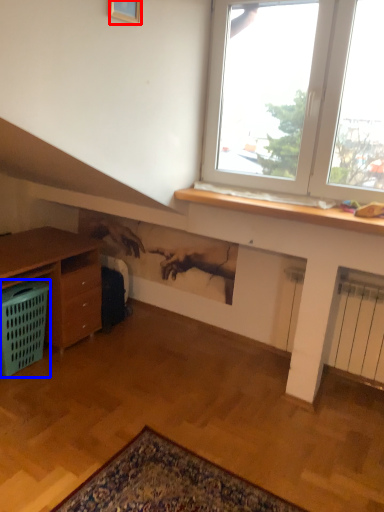
Question: Among these objects, which one is nearest to the camera, picture frame (highlighted by a red box) or basket (highlighted by a blue box)?

Choices:
 (A) picture frame
 (B) basket

Answer: (A)